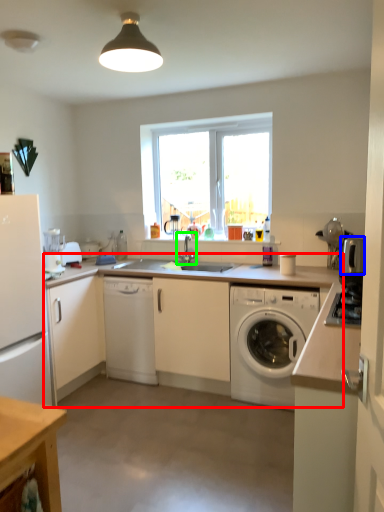
Question: Which is nearer to the countertop (highlighted by a red box)? appliance (highlighted by a blue box) or tap (highlighted by a green box).

Choices:
 (A) appliance
 (B) tap

Answer: (B)